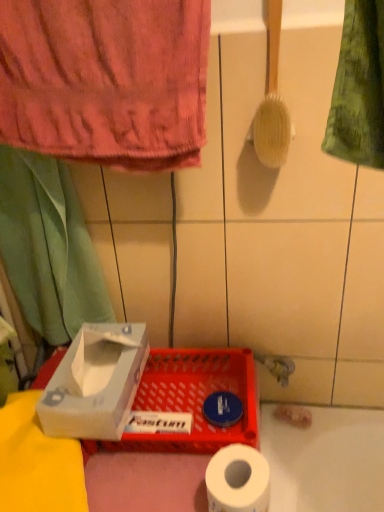
In order to face white matte toilet paper at lower center, should I rotate leftwards or rightwards?

Rotate right and turn 5.806 degrees.

What do you see at coordinates (106, 80) in the screenshot?
I see `pink cotton towel at upper left` at bounding box center [106, 80].

In order to click on matte plastic basket at lower center in this screenshot , I will do `click(191, 400)`.

Find the location of `white matte toilet paper at lower center`. white matte toilet paper at lower center is located at coordinates (238, 480).

Considering the sizes of objects white matte toilet paper at lower center and pink cotton towel at upper left in the image provided, who is shorter, white matte toilet paper at lower center or pink cotton towel at upper left?

white matte toilet paper at lower center.

Is white matte toilet paper at lower center positioned far away from pink cotton towel at upper left?

No, white matte toilet paper at lower center is in close proximity to pink cotton towel at upper left.

Is white matte toilet paper at lower center not inside pink cotton towel at upper left?

Indeed, white matte toilet paper at lower center is completely outside pink cotton towel at upper left.

Considering the sizes of white cardboard box at lower left and white matte toilet paper at lower center in the image, is white cardboard box at lower left taller or shorter than white matte toilet paper at lower center?

Considering their sizes, white cardboard box at lower left has more height than white matte toilet paper at lower center.

Relative to white matte toilet paper at lower center, is white cardboard box at lower left in front or behind?

Clearly, white cardboard box at lower left is behind white matte toilet paper at lower center.

From the picture: Considering the relative positions of white cardboard box at lower left and white matte toilet paper at lower center in the image provided, is white cardboard box at lower left to the right of white matte toilet paper at lower center from the viewer's perspective?

In fact, white cardboard box at lower left is to the left of white matte toilet paper at lower center.

Is white cardboard box at lower left oriented away from white matte toilet paper at lower center?

No, white cardboard box at lower left is not facing the opposite direction of white matte toilet paper at lower center.

Can you confirm if white cardboard box at lower left is positioned to the right of green fabric curtain at left?

Yes, white cardboard box at lower left is to the right of green fabric curtain at left.

From their relative heights in the image, would you say white cardboard box at lower left is taller or shorter than green fabric curtain at left?

Considering their sizes, white cardboard box at lower left has less height than green fabric curtain at left.

Is white cardboard box at lower left further to the viewer compared to green fabric curtain at left?

No, white cardboard box at lower left is closer to the camera.

From a real-world perspective, is white cardboard box at lower left beneath green fabric curtain at left?

Yes.

Visually, is green fabric curtain at left positioned to the left or to the right of white cardboard box at lower left?

green fabric curtain at left is to the left of white cardboard box at lower left.

Is point (48, 312) closer or farther from the camera than point (74, 423)?

Point (48, 312) appears to be farther away from the viewer than point (74, 423).

Is green fabric curtain at left not within white cardboard box at lower left?

That's correct, green fabric curtain at left is outside of white cardboard box at lower left.

Is white cardboard box at lower left at the back of green fabric curtain at left?

No.

Locate an element on the screen. This screenshot has width=384, height=512. basket beneath the white cardboard box at lower left (from a real-world perspective) is located at coordinates (191, 400).

Is white cardboard box at lower left directly adjacent to matte plastic basket at lower center?

No.

From a real-world perspective, is white cardboard box at lower left physically below matte plastic basket at lower center?

No.

Can you confirm if white matte toilet paper at lower center is positioned to the left of wooden bristles brush at upper right?

Yes, white matte toilet paper at lower center is to the left of wooden bristles brush at upper right.

Considering the sizes of objects white matte toilet paper at lower center and wooden bristles brush at upper right in the image provided, who is taller, white matte toilet paper at lower center or wooden bristles brush at upper right?

Standing taller between the two is wooden bristles brush at upper right.

Is white matte toilet paper at lower center directly adjacent to wooden bristles brush at upper right?

white matte toilet paper at lower center is not next to wooden bristles brush at upper right, and they're not touching.

Considering the positions of point (50, 19) and point (165, 354), is point (50, 19) closer or farther from the camera than point (165, 354)?

Point (50, 19) is closer to the camera than point (165, 354).

Who is shorter, pink cotton towel at upper left or matte plastic basket at lower center?

matte plastic basket at lower center.

Is the position of pink cotton towel at upper left less distant than that of matte plastic basket at lower center?

Yes, pink cotton towel at upper left is closer to the viewer.

Is pink cotton towel at upper left aimed at matte plastic basket at lower center?

No, pink cotton towel at upper left does not turn towards matte plastic basket at lower center.

Identify the location of towel in front of the white matte toilet paper at lower center. The image size is (384, 512). (106, 80).

Where is `toilet paper below the white cardboard box at lower left (from a real-world perspective)`? This screenshot has width=384, height=512. toilet paper below the white cardboard box at lower left (from a real-world perspective) is located at coordinates (238, 480).

Estimate the real-world distances between objects in this image. Which object is closer to green fabric curtain at left, pink cotton towel at upper left or white cardboard box at lower left?

white cardboard box at lower left is positioned closer to the anchor green fabric curtain at left.

Consider the image. Looking at the image, which one is located closer to pink cotton towel at upper left, matte plastic basket at lower center or white cardboard box at lower left?

The object closer to pink cotton towel at upper left is white cardboard box at lower left.

Looking at this image, considering their positions, is white cardboard box at lower left positioned further to wooden bristles brush at upper right than pink cotton towel at upper left?

Based on the image, white cardboard box at lower left appears to be further to wooden bristles brush at upper right.

Which object lies further to the anchor point white matte toilet paper at lower center, matte plastic basket at lower center or pink cotton towel at upper left?

pink cotton towel at upper left is positioned further to the anchor white matte toilet paper at lower center.

Considering their positions, is white matte toilet paper at lower center positioned closer to wooden bristles brush at upper right than white cardboard box at lower left?

white cardboard box at lower left is closer to wooden bristles brush at upper right.

Based on their spatial positions, is wooden bristles brush at upper right or green fabric curtain at left closer to white matte toilet paper at lower center?

The object closer to white matte toilet paper at lower center is green fabric curtain at left.

Which object lies nearer to the anchor point green fabric curtain at left, wooden bristles brush at upper right or matte plastic basket at lower center?

matte plastic basket at lower center.

When comparing their distances from green fabric curtain at left, does white cardboard box at lower left or white matte toilet paper at lower center seem closer?

The object closer to green fabric curtain at left is white cardboard box at lower left.

Locate an element on the screen. Image resolution: width=384 pixels, height=512 pixels. cardboard box between wooden bristles brush at upper right and white matte toilet paper at lower center from top to bottom is located at coordinates (95, 382).

Image resolution: width=384 pixels, height=512 pixels. I want to click on cardboard box between green fabric curtain at left and white matte toilet paper at lower center in the horizontal direction, so click(x=95, y=382).

Locate an element on the screen. Image resolution: width=384 pixels, height=512 pixels. towel between wooden bristles brush at upper right and white cardboard box at lower left in the vertical direction is located at coordinates (106, 80).

You are a GUI agent. You are given a task and a screenshot of the screen. Output one action in this format:
    pyautogui.click(x=<x>, y=<y>)
    Task: Click on the cardboard box between green fabric curtain at left and matte plastic basket at lower center from top to bottom
    The height and width of the screenshot is (512, 384).
    Given the screenshot: What is the action you would take?
    pyautogui.click(x=95, y=382)